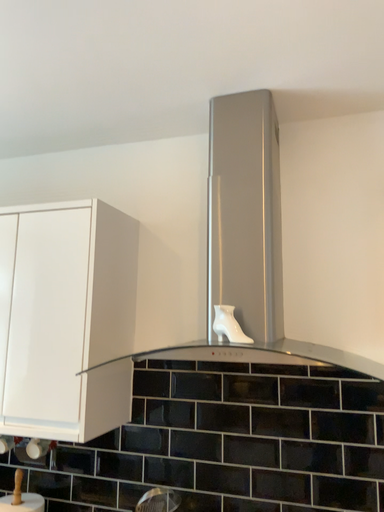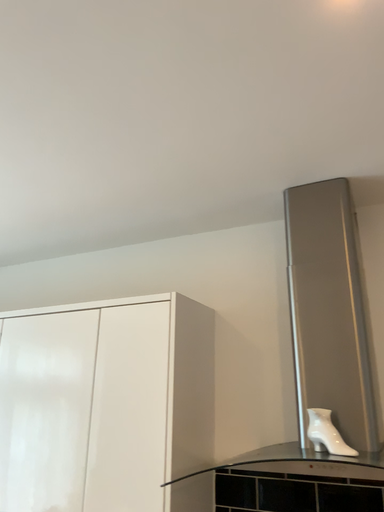
Question: How did the camera likely rotate when shooting the video?

Choices:
 (A) rotated downward
 (B) rotated upward

Answer: (B)